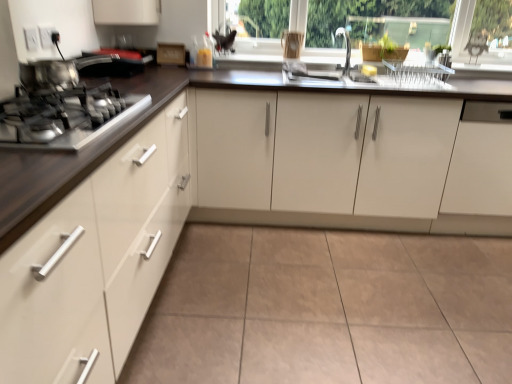
Question: Does white glossy cabinets at center, which is counted as the second cabinetry, starting from the right, have a greater height compared to metallic silver gas stove at left?

Choices:
 (A) yes
 (B) no

Answer: (A)

Question: Is white glossy cabinets at center, which is counted as the second cabinetry, starting from the right, closer to the viewer compared to metallic silver gas stove at left?

Choices:
 (A) no
 (B) yes

Answer: (A)

Question: Is white glossy cabinets at center, which is the 2th cabinetry from left to right, behind metallic silver gas stove at left?

Choices:
 (A) no
 (B) yes

Answer: (B)

Question: From a real-world perspective, is white glossy cabinets at center, which is the 2th cabinetry from left to right, over metallic silver gas stove at left?

Choices:
 (A) no
 (B) yes

Answer: (A)

Question: Is white glossy cabinets at center, which is counted as the second cabinetry, starting from the right, to the right of metallic silver gas stove at left from the viewer's perspective?

Choices:
 (A) no
 (B) yes

Answer: (B)

Question: Would you say white glossy cabinets at center, which is the 2th cabinetry from left to right, is inside or outside white matte cabinet at right, positioned as the 1th cabinetry in right-to-left order?

Choices:
 (A) outside
 (B) inside

Answer: (A)

Question: Is white glossy cabinets at center, which is the 2th cabinetry from left to right, in front of or behind white matte cabinet at right, positioned as the 1th cabinetry in right-to-left order, in the image?

Choices:
 (A) behind
 (B) front

Answer: (B)

Question: From the image's perspective, is white glossy cabinets at center, which is counted as the second cabinetry, starting from the right, positioned above or below white matte cabinet at right, which is counted as the third cabinetry, starting from the left?

Choices:
 (A) below
 (B) above

Answer: (B)

Question: Considering the relative positions of white glossy cabinets at center, which is counted as the second cabinetry, starting from the right, and white matte cabinet at right, which is counted as the third cabinetry, starting from the left, in the image provided, is white glossy cabinets at center, which is counted as the second cabinetry, starting from the right, to the left or to the right of white matte cabinet at right, which is counted as the third cabinetry, starting from the left,?

Choices:
 (A) left
 (B) right

Answer: (A)

Question: In terms of width, does transparent glass window frame at upper center look wider or thinner when compared to white matte cabinet at right, positioned as the 1th cabinetry in right-to-left order?

Choices:
 (A) wide
 (B) thin

Answer: (B)

Question: Does point (327, 21) appear closer or farther from the camera than point (495, 145)?

Choices:
 (A) farther
 (B) closer

Answer: (A)

Question: From the image's perspective, relative to white matte cabinet at right, positioned as the 1th cabinetry in right-to-left order, is transparent glass window frame at upper center above or below?

Choices:
 (A) above
 (B) below

Answer: (A)

Question: Considering the positions of transparent glass window frame at upper center and white matte cabinet at right, positioned as the 1th cabinetry in right-to-left order, in the image, is transparent glass window frame at upper center taller or shorter than white matte cabinet at right, positioned as the 1th cabinetry in right-to-left order,?

Choices:
 (A) tall
 (B) short

Answer: (B)

Question: Relative to metallic silver gas stove at left, is metallic silver pot at left in front or behind?

Choices:
 (A) front
 (B) behind

Answer: (B)

Question: Considering the positions of metallic silver pot at left and metallic silver gas stove at left in the image, is metallic silver pot at left taller or shorter than metallic silver gas stove at left?

Choices:
 (A) short
 (B) tall

Answer: (B)